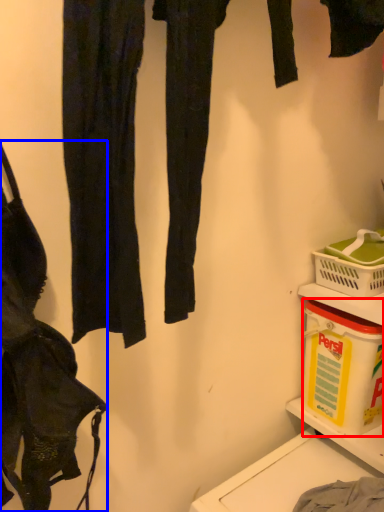
Question: Which object is further to the camera taking this photo, box (highlighted by a red box) or handbag (highlighted by a blue box)?

Choices:
 (A) box
 (B) handbag

Answer: (A)